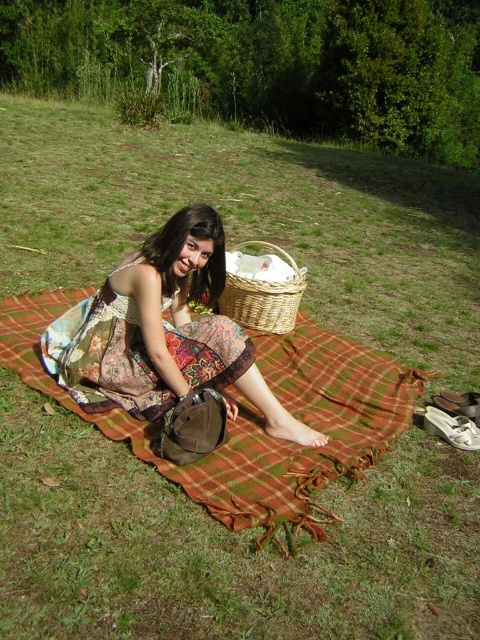
Question: Is the position of printed fabric dress at center less distant than that of woven natural basket at center?

Choices:
 (A) no
 (B) yes

Answer: (B)

Question: Which object is the farthest from the printed fabric dress at center?

Choices:
 (A) plaid woolen blanket at center
 (B) woven natural basket at center

Answer: (B)

Question: Which is farther from the plaid woolen blanket at center?

Choices:
 (A) printed fabric dress at center
 (B) woven natural basket at center

Answer: (B)

Question: Does printed fabric dress at center have a greater width compared to woven natural basket at center?

Choices:
 (A) yes
 (B) no

Answer: (A)

Question: Is plaid woolen blanket at center wider than printed fabric dress at center?

Choices:
 (A) no
 (B) yes

Answer: (B)

Question: Which object appears farthest from the camera in this image?

Choices:
 (A) plaid woolen blanket at center
 (B) woven natural basket at center

Answer: (B)